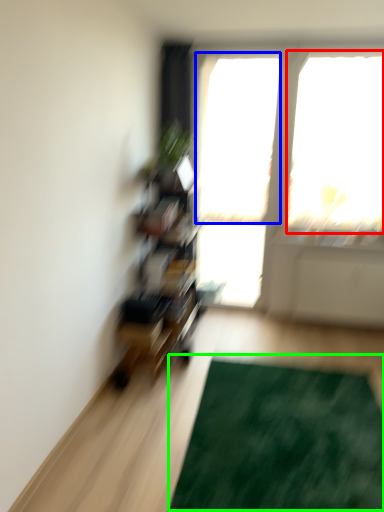
Question: Estimate the real-world distances between objects in this image. Which object is closer to window screen (highlighted by a red box), window screen (highlighted by a blue box) or doormat (highlighted by a green box)?

Choices:
 (A) window screen
 (B) doormat

Answer: (A)